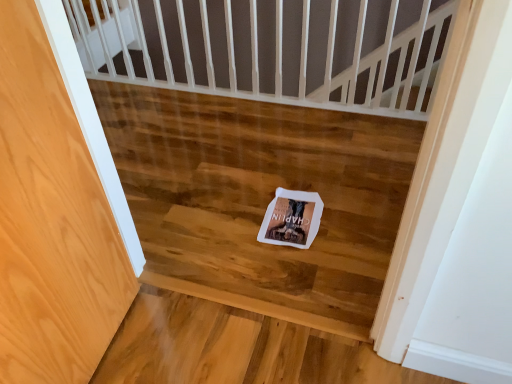
Question: Do you think white paper postcard at center is within wooden floor at center, or outside of it?

Choices:
 (A) outside
 (B) inside

Answer: (B)

Question: Is point (279, 187) positioned closer to the camera than point (356, 228)?

Choices:
 (A) closer
 (B) farther

Answer: (B)

Question: Looking at the image, does white paper postcard at center seem bigger or smaller compared to wooden floor at center?

Choices:
 (A) small
 (B) big

Answer: (A)

Question: Based on their positions, is wooden floor at center located to the left or right of white paper postcard at center?

Choices:
 (A) left
 (B) right

Answer: (A)

Question: From the image's perspective, relative to white paper postcard at center, is wooden floor at center above or below?

Choices:
 (A) below
 (B) above

Answer: (B)

Question: From a real-world perspective, is wooden floor at center physically located above or below white paper postcard at center?

Choices:
 (A) below
 (B) above

Answer: (B)

Question: Is wooden floor at center inside or outside of white paper postcard at center?

Choices:
 (A) inside
 (B) outside

Answer: (B)